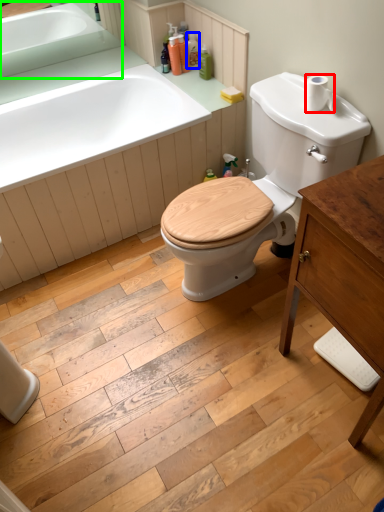
Question: Estimate the real-world distances between objects in this image. Which object is closer to toilet paper (highlighted by a red box), toiletry (highlighted by a blue box) or sink (highlighted by a green box)?

Choices:
 (A) toiletry
 (B) sink

Answer: (A)